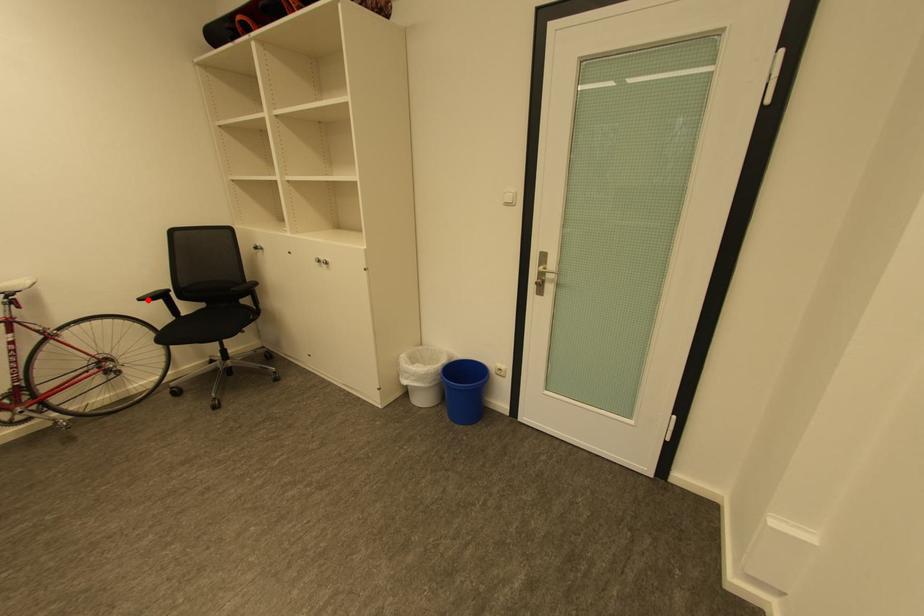
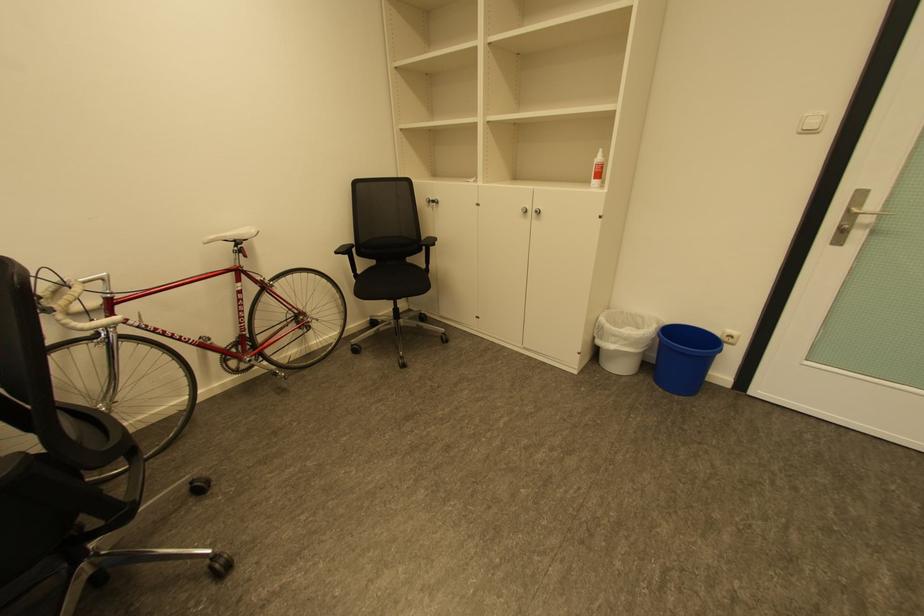
In the second image, find the point that corresponds to the highlighted location in the first image.

(344, 253)